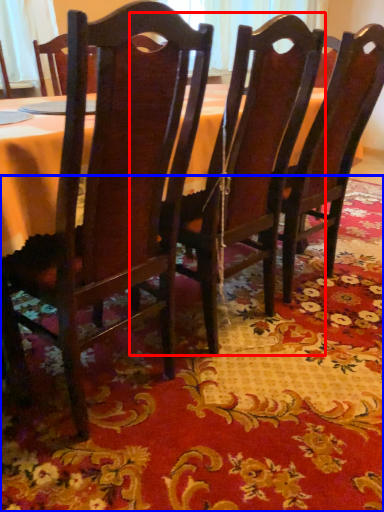
Question: Which of the following is the closest to the observer, chair (highlighted by a red box) or place mat (highlighted by a blue box)?

Choices:
 (A) chair
 (B) place mat

Answer: (B)